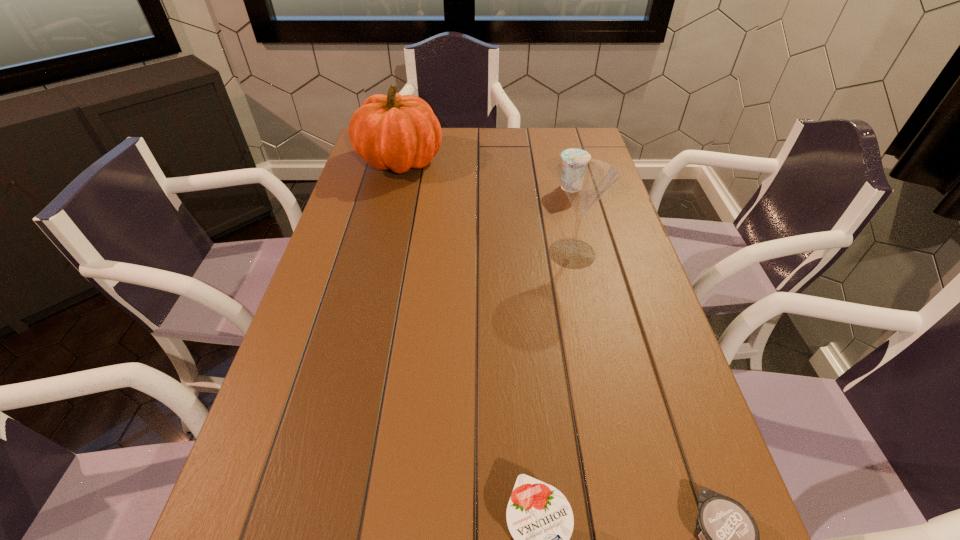
Select which object appears as the fourth closest to the second yogurt from left to right. Please provide its 2D coordinates. Your answer should be formatted as a tuple, i.e. [(x, y)], where the tuple contains the x and y coordinates of a point satisfying the conditions above.

[(540, 519)]

Where is `yogurt that stands as the closest to the flute glass`? Image resolution: width=960 pixels, height=540 pixels. yogurt that stands as the closest to the flute glass is located at coordinates (573, 152).

I want to click on yogurt that is the third closest to the third farthest object, so click(540, 519).

Where is `vacant space that satisfies the following two spatial constraints: 1. on the back side of the third nearest object; 2. on the right side of the farthest yogurt`? vacant space that satisfies the following two spatial constraints: 1. on the back side of the third nearest object; 2. on the right side of the farthest yogurt is located at coordinates (558, 188).